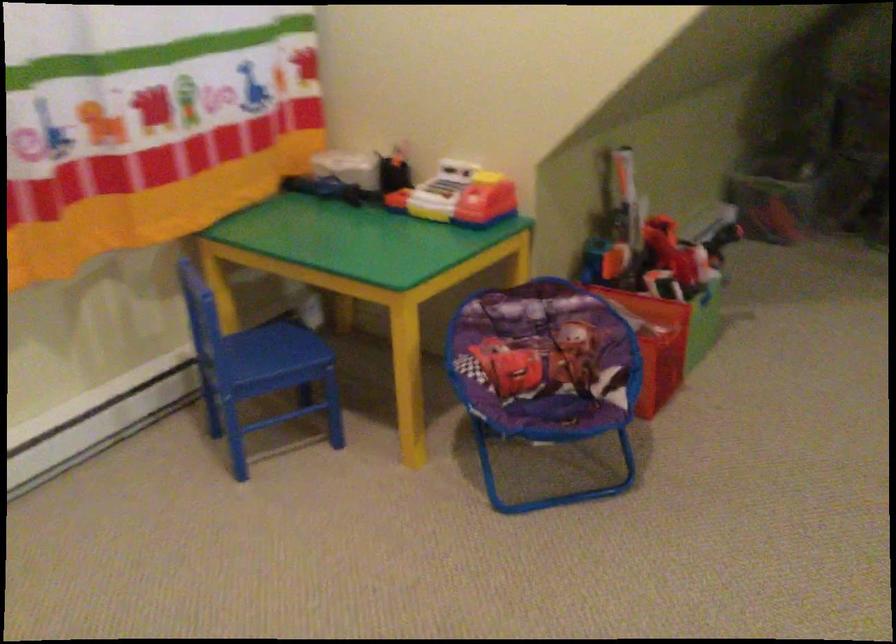
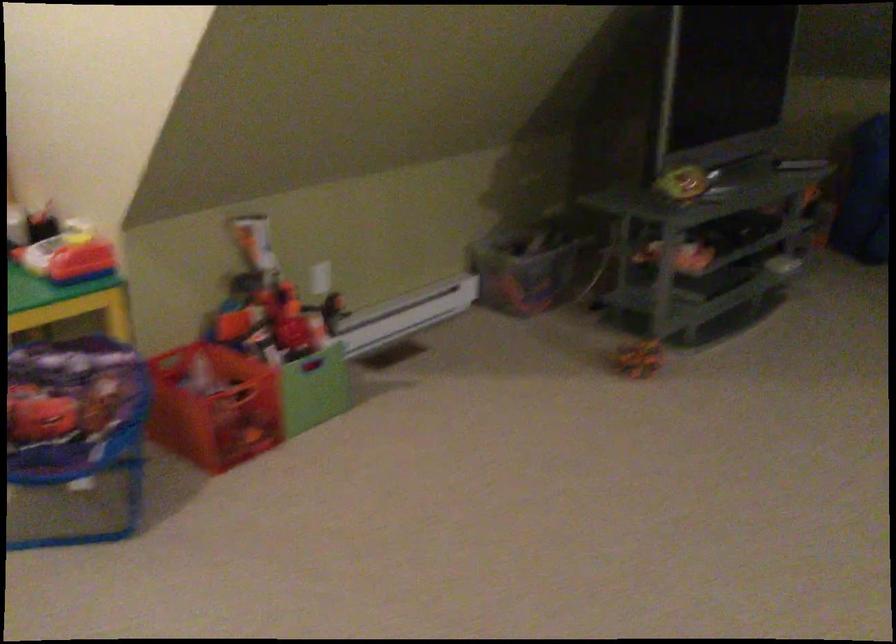
Question: In a continuous first-person perspective shot, in which direction is the camera moving?

Choices:
 (A) Left
 (B) Right
 (C) Forward
 (D) Backward

Answer: (B)